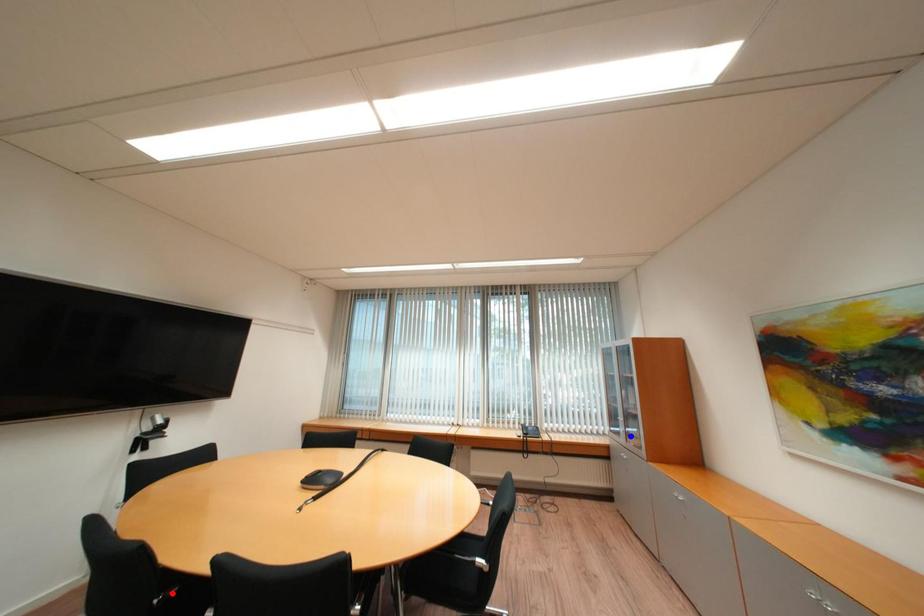
Question: Which of the two points in the image is closer to the camera?

Choices:
 (A) Blue point is closer.
 (B) Red point is closer.

Answer: (B)